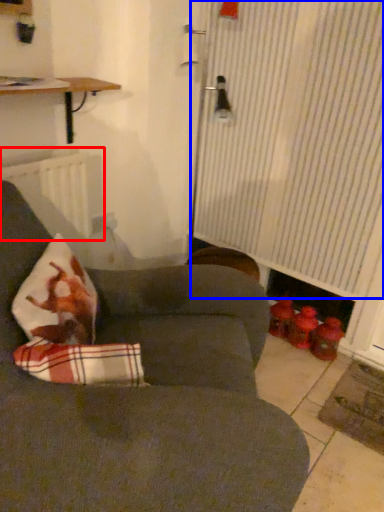
Question: Which of the following is the farthest to the observer, radiator (highlighted by a red box) or curtain (highlighted by a blue box)?

Choices:
 (A) radiator
 (B) curtain

Answer: (A)